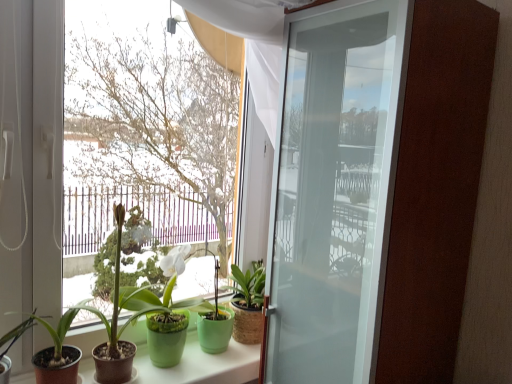
Locate an element on the screen. The width and height of the screenshot is (512, 384). green matte pot at center, the second houseplant when ordered from right to left is located at coordinates (162, 320).

The height and width of the screenshot is (384, 512). Describe the element at coordinates (196, 361) in the screenshot. I see `green matte plant pots at lower center` at that location.

This screenshot has width=512, height=384. Describe the element at coordinates (332, 191) in the screenshot. I see `frosted glass door at center` at that location.

This screenshot has height=384, width=512. What are the coordinates of `green matte pot at lower left, the 2th houseplant viewed from the left` in the screenshot? It's located at (58, 351).

Between green matte pot at center, which is the 3th houseplant from left to right, and transparent glass window at center, which one has smaller size?

Smaller between the two is green matte pot at center, which is the 3th houseplant from left to right.

Which is less distant, (79, 307) or (99, 150)?

Point (79, 307) appears to be closer to the viewer than point (99, 150).

Would you say green matte pot at center, placed as the 3th houseplant when sorted from right to left, is outside transparent glass window at center?

That's correct, green matte pot at center, placed as the 3th houseplant when sorted from right to left, is outside of transparent glass window at center.

Who is more distant, green matte pot at center, which is the 3th houseplant from left to right, or transparent glass window at center?

green matte pot at center, which is the 3th houseplant from left to right, is further away from the camera.

Is burlap-textured plant pot at center, which appears as the fifth houseplant when viewed from the left, facing towards green matte pot at center, placed as the 3th houseplant when sorted from right to left?

No, burlap-textured plant pot at center, which appears as the fifth houseplant when viewed from the left, is not turned towards green matte pot at center, placed as the 3th houseplant when sorted from right to left.

From the image's perspective, which one is positioned higher, burlap-textured plant pot at center, the 1th houseplant in the right-to-left sequence, or green matte pot at center, which is the 3th houseplant from left to right?

green matte pot at center, which is the 3th houseplant from left to right.

From the image's perspective, count 3rd houseplants downward from the green matte pot at center, which is the 3th houseplant from left to right, and point to it. Please provide its 2D coordinates.

[(248, 302)]

Is burlap-textured plant pot at center, the 1th houseplant in the right-to-left sequence, to the left of green matte pot at center, which is the 3th houseplant from left to right, from the viewer's perspective?

In fact, burlap-textured plant pot at center, the 1th houseplant in the right-to-left sequence, is to the right of green matte pot at center, which is the 3th houseplant from left to right.

Consider the image. How different are the orientations of transparent glass window at center and burlap-textured plant pot at center, the 1th houseplant in the right-to-left sequence, in degrees?

transparent glass window at center and burlap-textured plant pot at center, the 1th houseplant in the right-to-left sequence, are facing 0.000162 degrees away from each other.

Which is more to the right, transparent glass window at center or burlap-textured plant pot at center, the 1th houseplant in the right-to-left sequence?

burlap-textured plant pot at center, the 1th houseplant in the right-to-left sequence, is more to the right.

Is transparent glass window at center bigger than burlap-textured plant pot at center, which appears as the fifth houseplant when viewed from the left?

Indeed, transparent glass window at center has a larger size compared to burlap-textured plant pot at center, which appears as the fifth houseplant when viewed from the left.

Is point (126, 114) closer or farther from the camera than point (258, 327)?

Point (126, 114).

From a real-world perspective, is green matte plant pots at lower center located higher than transparent glass window at center?

Incorrect, from a real-world perspective, green matte plant pots at lower center is lower than transparent glass window at center.

Considering the relative sizes of green matte plant pots at lower center and transparent glass window at center in the image provided, is green matte plant pots at lower center taller than transparent glass window at center?

No.

Locate an element on the screen. window above the green matte plant pots at lower center (from the image's perspective) is located at coordinates (145, 126).

Is the depth of green matte pot at center, the second houseplant when ordered from right to left, less than that of green matte pot at center, which is the 3th houseplant from left to right?

No, green matte pot at center, the second houseplant when ordered from right to left, is further to the viewer.

From the image's perspective, is green matte pot at center, the second houseplant when ordered from right to left, above green matte pot at center, placed as the 3th houseplant when sorted from right to left?

No.

Considering the sizes of objects green matte pot at center, which is the fourth houseplant from left to right, and green matte pot at center, which is the 3th houseplant from left to right, in the image provided, who is bigger, green matte pot at center, which is the fourth houseplant from left to right, or green matte pot at center, which is the 3th houseplant from left to right,?

green matte pot at center, which is the 3th houseplant from left to right, is bigger.

Is green matte pot at center, the second houseplant when ordered from right to left, inside the boundaries of green matte pot at center, which is the 3th houseplant from left to right, or outside?

green matte pot at center, the second houseplant when ordered from right to left, can be found inside green matte pot at center, which is the 3th houseplant from left to right.

From a real-world perspective, between burlap-textured plant pot at center, the 1th houseplant in the right-to-left sequence, and green matte plant pots at lower center, who is vertically higher?

burlap-textured plant pot at center, the 1th houseplant in the right-to-left sequence.

Is point (245, 337) positioned before point (242, 370)?

No, it is not.

Locate an element on the screen. This screenshot has height=384, width=512. window sill below the burlap-textured plant pot at center, the 1th houseplant in the right-to-left sequence (from the image's perspective) is located at coordinates (196, 361).

Is green matte pot at center, placed as the 3th houseplant when sorted from right to left, in contact with green matte plant pots at lower center?

There is a gap between green matte pot at center, placed as the 3th houseplant when sorted from right to left, and green matte plant pots at lower center.

Where is `the 2nd houseplant to the left when counting from the green matte plant pots at lower center`? the 2nd houseplant to the left when counting from the green matte plant pots at lower center is located at coordinates (119, 312).

From the image's perspective, is green matte pot at center, which is the 3th houseplant from left to right, over green matte plant pots at lower center?

Yes, from the image's perspective, green matte pot at center, which is the 3th houseplant from left to right, is on top of green matte plant pots at lower center.

Locate an element on the screen. This screenshot has height=384, width=512. window above the green matte pot at center, placed as the 3th houseplant when sorted from right to left (from a real-world perspective) is located at coordinates (145, 126).

From a real-world perspective, count 4th houseplants downward from the green matte pot at center, which is the 3th houseplant from left to right, and point to it. Please provide its 2D coordinates.

[(248, 302)]

Estimate the real-world distances between objects in this image. Which object is further from frosted glass door at center, green matte plant pots at lower center or green matte pot at lower left, positioned as the 5th houseplant in right-to-left order?

Based on the image, green matte pot at lower left, positioned as the 5th houseplant in right-to-left order, appears to be further to frosted glass door at center.

Based on their spatial positions, is frosted glass door at center or green matte pot at center, which is the 3th houseplant from left to right, closer to burlap-textured plant pot at center, the 1th houseplant in the right-to-left sequence?

green matte pot at center, which is the 3th houseplant from left to right, is closer to burlap-textured plant pot at center, the 1th houseplant in the right-to-left sequence.

Consider the image. Considering their positions, is transparent glass window at center positioned closer to green matte plant pots at lower center than burlap-textured plant pot at center, which appears as the fifth houseplant when viewed from the left?

burlap-textured plant pot at center, which appears as the fifth houseplant when viewed from the left, is closer to green matte plant pots at lower center.

Considering their positions, is frosted glass door at center positioned closer to green matte plant pots at lower center than green matte pot at lower left, the 2th houseplant viewed from the left?

green matte pot at lower left, the 2th houseplant viewed from the left, is closer to green matte plant pots at lower center.

Estimate the real-world distances between objects in this image. Which object is closer to green matte plant pots at lower center, burlap-textured plant pot at center, the 1th houseplant in the right-to-left sequence, or frosted glass door at center?

burlap-textured plant pot at center, the 1th houseplant in the right-to-left sequence, is closer to green matte plant pots at lower center.

Looking at the image, which one is located closer to green matte pot at center, which is the fourth houseplant from left to right, green matte plant pots at lower center or green matte pot at lower left, the 2th houseplant viewed from the left?

green matte plant pots at lower center is closer to green matte pot at center, which is the fourth houseplant from left to right.

From the image, which object appears to be nearer to transparent glass window at center, frosted glass door at center or green matte pot at lower left, positioned as the 5th houseplant in right-to-left order?

Based on the image, frosted glass door at center appears to be nearer to transparent glass window at center.

When comparing their distances from green matte pot at lower left, arranged as the 1th houseplant when viewed from the left, does frosted glass door at center or burlap-textured plant pot at center, which appears as the fifth houseplant when viewed from the left, seem further?

frosted glass door at center is further to green matte pot at lower left, arranged as the 1th houseplant when viewed from the left.

Identify the location of window sill between green matte pot at lower left, positioned as the fourth houseplant in right-to-left order, and frosted glass door at center, in the horizontal direction. (196, 361).

Find the location of a particular element. The width and height of the screenshot is (512, 384). window sill between green matte pot at center, which is the fourth houseplant from left to right, and frosted glass door at center, in the horizontal direction is located at coordinates (196, 361).

This screenshot has height=384, width=512. I want to click on houseplant between transparent glass window at center and green matte pot at center, which is the fourth houseplant from left to right, vertically, so click(x=119, y=312).

Where is `window located between green matte pot at lower left, positioned as the fourth houseplant in right-to-left order, and frosted glass door at center in the left-right direction`? Image resolution: width=512 pixels, height=384 pixels. window located between green matte pot at lower left, positioned as the fourth houseplant in right-to-left order, and frosted glass door at center in the left-right direction is located at coordinates (145, 126).